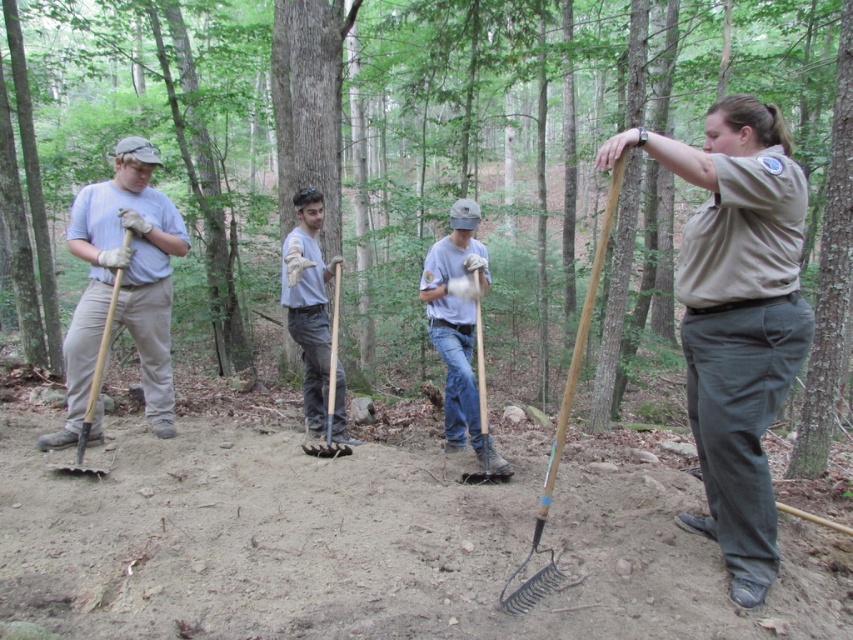
You are a visitor in the woods and want to approach the matte gray shirt at center without getting too close to the brushed metal shovel at left. Which direction should you move in?

Since the matte gray shirt at center is closer to you than the brushed metal shovel at left, you should move forward towards the matte gray shirt at center to avoid the shovel.

You are a photographer aiming to capture a clear photo of the light gray fabric shirt at center and the wooden shovel at center. Since you want the shirt to be visible on the left side of the shovel in the photo, does the current arrangement allow this?

Yes, the light gray fabric shirt at center is positioned on the left side of the wooden shovel at center, so the current arrangement allows the shirt to be visible on the left side of the shovel in the photo.

You are planning to take a photo of the matte gray shirt at center and the brushed metal shovel at left. Which object should you focus on to ensure it appears larger in the photo?

The matte gray shirt at center should be focused on because it is bigger than the brushed metal shovel at left, so it will naturally appear larger in the photo.